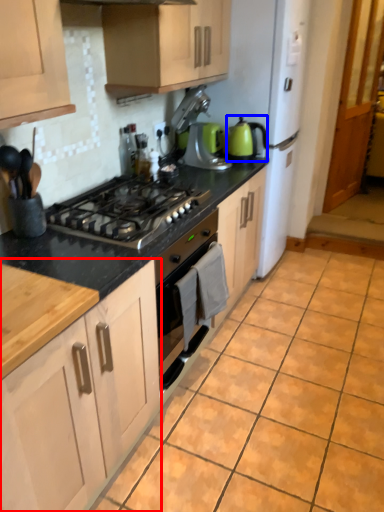
Question: Which point is further to the camera, cabinetry (highlighted by a red box) or tea pot (highlighted by a blue box)?

Choices:
 (A) cabinetry
 (B) tea pot

Answer: (B)